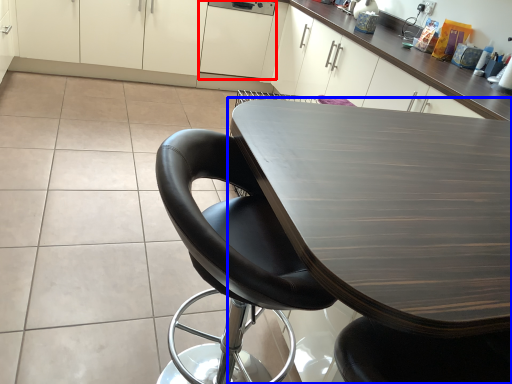
Question: Which object is closer to the camera taking this photo, cabinetry (highlighted by a red box) or table (highlighted by a blue box)?

Choices:
 (A) cabinetry
 (B) table

Answer: (B)